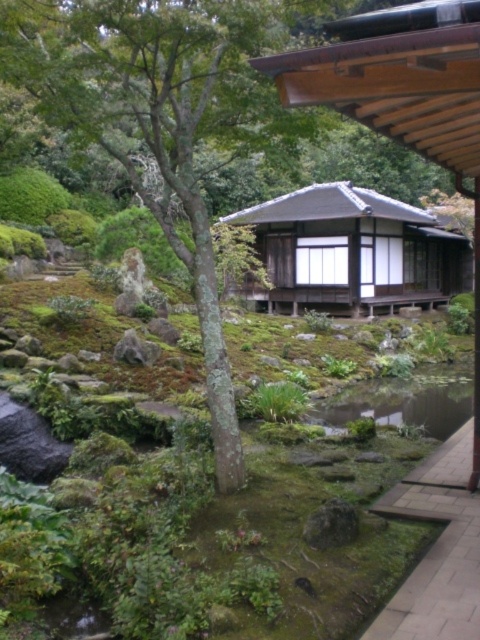
Between paved stone path at lower right and green mossy stream at center, which one is positioned higher?

green mossy stream at center

Is paved stone path at lower right positioned before green mossy stream at center?

Yes, paved stone path at lower right is in front of green mossy stream at center.

Is point (405, 602) positioned behind point (421, 387)?

No, (405, 602) is in front of (421, 387).

I want to click on paved stone path at lower right, so click(436, 548).